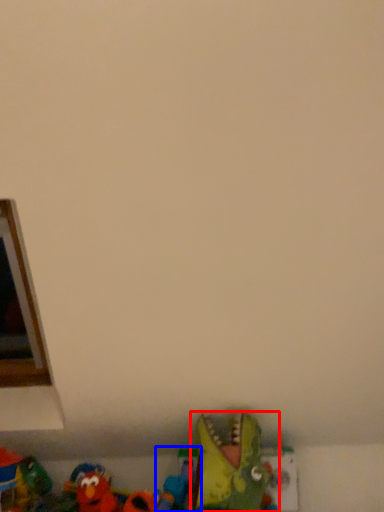
Question: Which object appears farthest to the camera in this image, toy (highlighted by a red box) or toy (highlighted by a blue box)?

Choices:
 (A) toy
 (B) toy

Answer: (B)